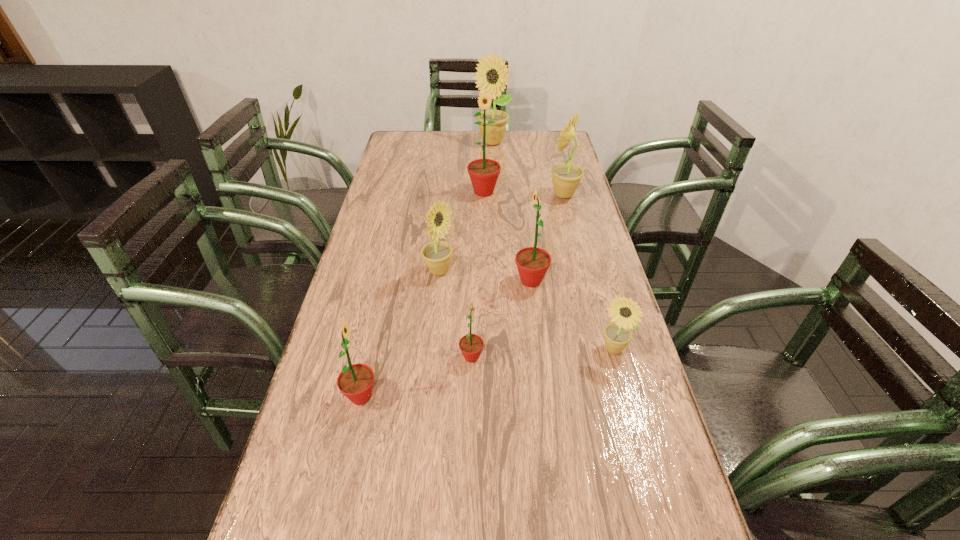
This screenshot has height=540, width=960. In order to click on vacant space located 0.400m on the face of the third biggest yellow sunflower in this screenshot , I will do `click(593, 271)`.

The height and width of the screenshot is (540, 960). Find the location of `vacant space located on the face of the leftmost sunflower`. vacant space located on the face of the leftmost sunflower is located at coordinates click(x=528, y=396).

At what (x,y) coordinates should I click in order to perform the action: click on vacant area located 0.230m on the face of the second nearest green sunflower. Please return your answer as a coordinate pair (x, y). This screenshot has height=540, width=960. Looking at the image, I should click on (580, 357).

Identify the location of vacant space located 0.330m on the face of the nearest yellow sunflower. This screenshot has height=540, width=960. click(657, 508).

This screenshot has width=960, height=540. I want to click on object that is at the far edge, so click(491, 70).

I want to click on object that is at the left edge, so pyautogui.click(x=356, y=381).

Locate an element on the screen. The image size is (960, 540). free point at the far edge is located at coordinates (527, 131).

In the image, there is a desktop. Identify the location of free space at the left edge. The image size is (960, 540). (398, 195).

Identify the location of free space at the right edge of the desktop. The width and height of the screenshot is (960, 540). (612, 475).

Where is `free spot at the far left corner of the desktop`? free spot at the far left corner of the desktop is located at coordinates (418, 156).